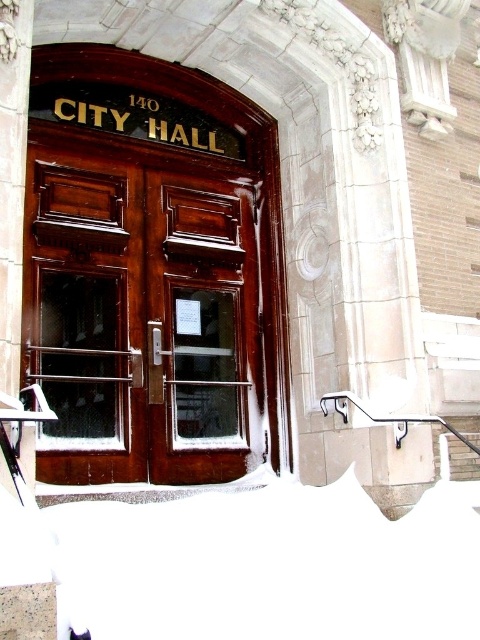
Question: Is shiny dark wood door at center to the left of white fluffy snow at lower center from the viewer's perspective?

Choices:
 (A) yes
 (B) no

Answer: (A)

Question: Which of the following is the farthest from the observer?

Choices:
 (A) click(x=470, y=600)
 (B) click(x=286, y=376)

Answer: (B)

Question: Is shiny dark wood door at center below white fluffy snow at lower center?

Choices:
 (A) yes
 (B) no

Answer: (B)

Question: Is shiny dark wood door at center positioned in front of white fluffy snow at lower center?

Choices:
 (A) yes
 (B) no

Answer: (B)